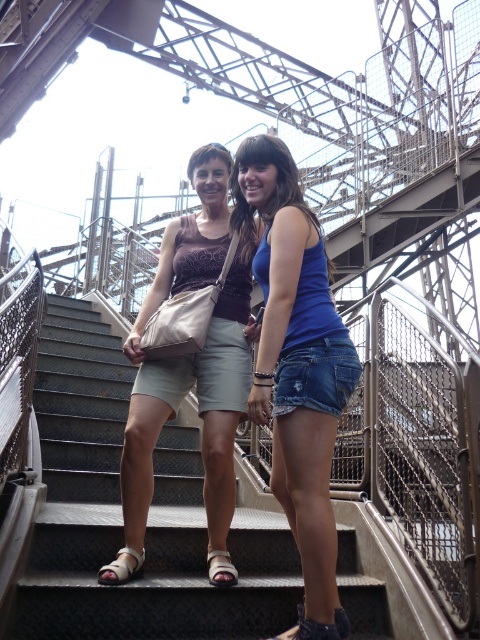
You are a safety inspector assessing the scene. You see the blue denim shorts at center and the matte beige shorts at center. According to safety protocols, workers must not stand directly below others when working at heights. Is there a violation here?

Yes, there is a violation. The blue denim shorts at center is located below the matte beige shorts at center, meaning the person wearing blue denim shorts is positioned directly underneath another worker, which violates safety protocols against standing below others at heights.

You are a delivery person carrying a box that is 3 meters long. You are on the metal stairs at center and want to move towards the matte beige shorts at center. Can you safely move the box without it extending beyond the staircase?

The metal stairs at center is 2.78 meters from matte beige shorts at center. Since the box is 3 meters long, it will extend beyond the staircase and may not be safe to move it that way. You should find a different route or method to transport the box safely.